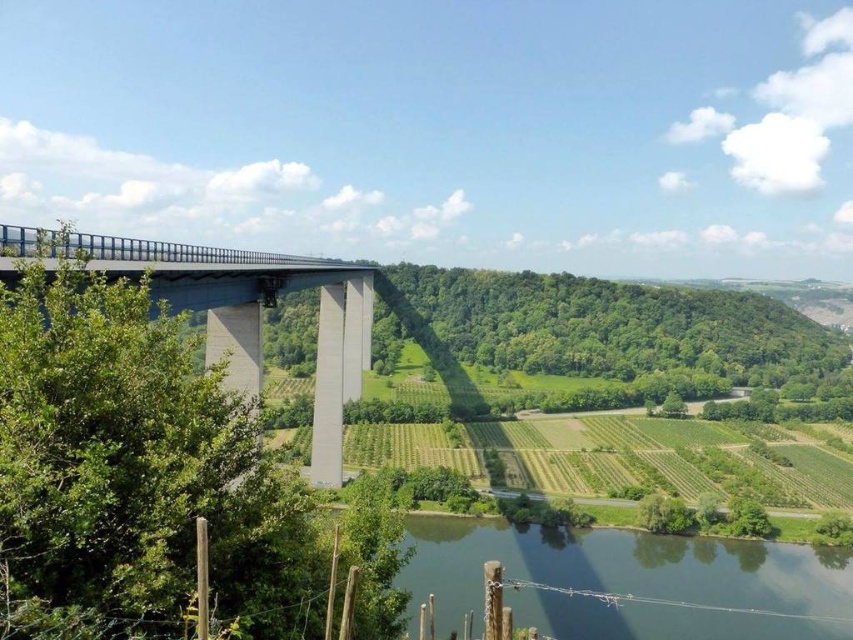
Which of these two, green smooth water at lower center or concrete bridge at left, stands taller?

With more height is concrete bridge at left.

Is green smooth water at lower center below concrete bridge at left?

Yes.

Find the location of a particular element. This screenshot has width=853, height=640. green smooth water at lower center is located at coordinates (630, 580).